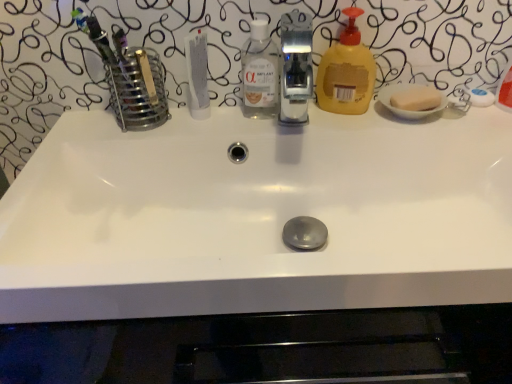
The height and width of the screenshot is (384, 512). Identify the location of vacant space that is in between satin nickel faucet at center and yellow translucent liquid soap at right. (329, 122).